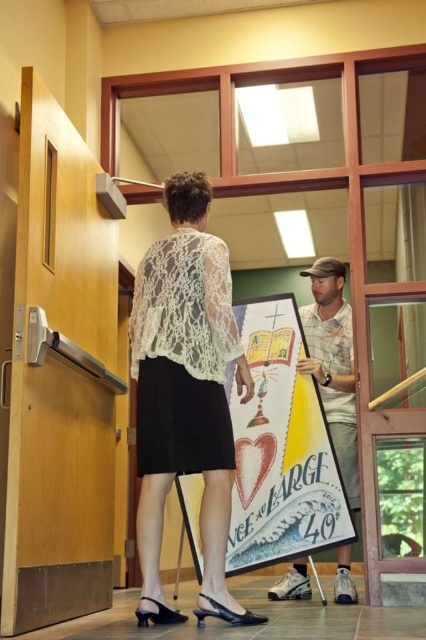
You are organizing a community event and need to ensure the white lace blouse at center and the matte paper poster at center are displayed properly. Which item should be placed to the right to align with their current positions?

The matte paper poster at center should be placed to the right since the white lace blouse at center is currently on its left side.

You are standing in the indoor setting and want to reach both point (x=271, y=314) and point (x=347, y=410). Which point is closer to you?

Point (x=271, y=314) is closer to you because it is further to the viewer than point (x=347, y=410).

You are trying to determine which object takes up more space in the image. Which one is larger between the white lace blouse at center and the matte paper poster at center?

Answer: The matte paper poster at center is larger than the white lace blouse at center because the white lace blouse at center occupies less space than the matte paper poster at center.